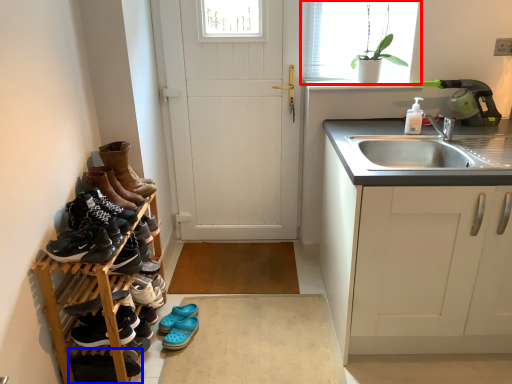
Question: Which object is closer to the camera taking this photo, window (highlighted by a red box) or footwear (highlighted by a blue box)?

Choices:
 (A) window
 (B) footwear

Answer: (B)